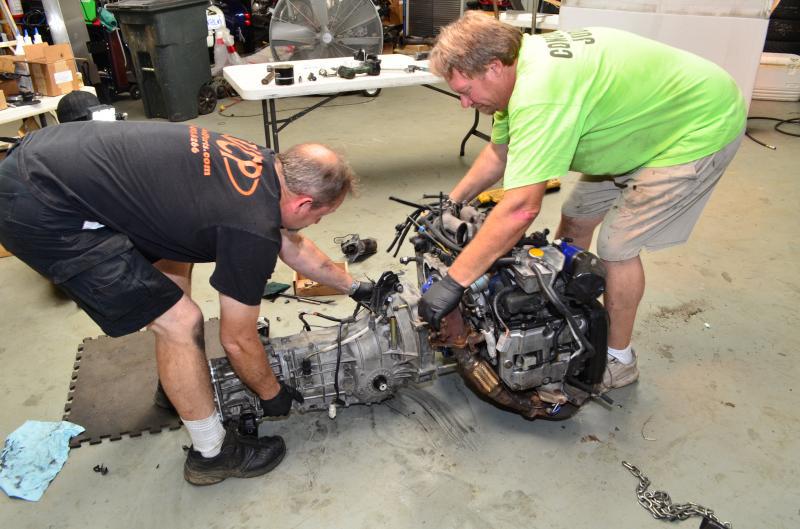
Locate an element on the screen. The height and width of the screenshot is (529, 800). fan is located at coordinates click(x=318, y=29).